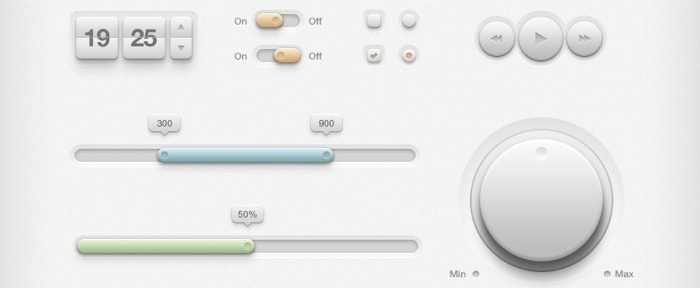
This screenshot has width=700, height=288. Find the location of `on switch`. on switch is located at coordinates (266, 22).